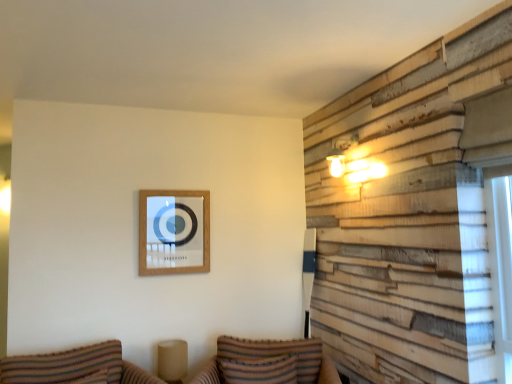
Question: In which direction should I rotate to look at striped fabric couch at lower center, the 2th couch when ordered from left to right?

Choices:
 (A) right
 (B) left

Answer: (A)

Question: Considering the relative positions of striped fabric couch at lower left, which is counted as the 2th couch, starting from the right, and striped fabric couch at lower center, which is the first couch in right-to-left order, in the image provided, is striped fabric couch at lower left, which is counted as the 2th couch, starting from the right, in front of striped fabric couch at lower center, which is the first couch in right-to-left order,?

Choices:
 (A) no
 (B) yes

Answer: (B)

Question: Can you confirm if striped fabric couch at lower left, acting as the first couch starting from the left, is wider than striped fabric couch at lower center, which is the first couch in right-to-left order?

Choices:
 (A) no
 (B) yes

Answer: (B)

Question: Are striped fabric couch at lower left, which is counted as the 2th couch, starting from the right, and striped fabric couch at lower center, the 2th couch when ordered from left to right, far apart?

Choices:
 (A) no
 (B) yes

Answer: (A)

Question: Is striped fabric couch at lower left, acting as the first couch starting from the left, smaller than striped fabric couch at lower center, the 2th couch when ordered from left to right?

Choices:
 (A) yes
 (B) no

Answer: (A)

Question: Is striped fabric couch at lower left, which is counted as the 2th couch, starting from the right, oriented away from striped fabric couch at lower center, the 2th couch when ordered from left to right?

Choices:
 (A) yes
 (B) no

Answer: (B)

Question: Considering the relative sizes of striped fabric couch at lower left, which is counted as the 2th couch, starting from the right, and striped fabric couch at lower center, which is the first couch in right-to-left order, in the image provided, is striped fabric couch at lower left, which is counted as the 2th couch, starting from the right, bigger than striped fabric couch at lower center, which is the first couch in right-to-left order,?

Choices:
 (A) no
 (B) yes

Answer: (A)

Question: From a real-world perspective, is striped fabric pillow at lower center below wooden picture frame at upper center?

Choices:
 (A) yes
 (B) no

Answer: (A)

Question: Is striped fabric pillow at lower center far away from wooden picture frame at upper center?

Choices:
 (A) yes
 (B) no

Answer: (B)

Question: From the image's perspective, is striped fabric pillow at lower center located above wooden picture frame at upper center?

Choices:
 (A) no
 (B) yes

Answer: (A)

Question: Is striped fabric pillow at lower center turned away from wooden picture frame at upper center?

Choices:
 (A) yes
 (B) no

Answer: (B)

Question: Does striped fabric pillow at lower center have a lesser height compared to wooden picture frame at upper center?

Choices:
 (A) no
 (B) yes

Answer: (B)

Question: Can you confirm if striped fabric pillow at lower center is smaller than wooden picture frame at upper center?

Choices:
 (A) yes
 (B) no

Answer: (B)

Question: From the image's perspective, is striped fabric pillow at lower center above striped fabric couch at lower left, which is counted as the 2th couch, starting from the right?

Choices:
 (A) yes
 (B) no

Answer: (A)